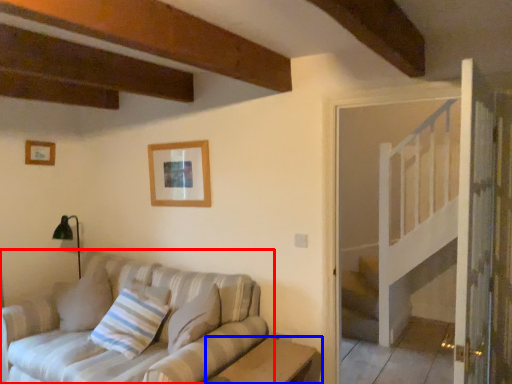
Question: Among these objects, which one is nearest to the camera, studio couch (highlighted by a red box) or table (highlighted by a blue box)?

Choices:
 (A) studio couch
 (B) table

Answer: (A)